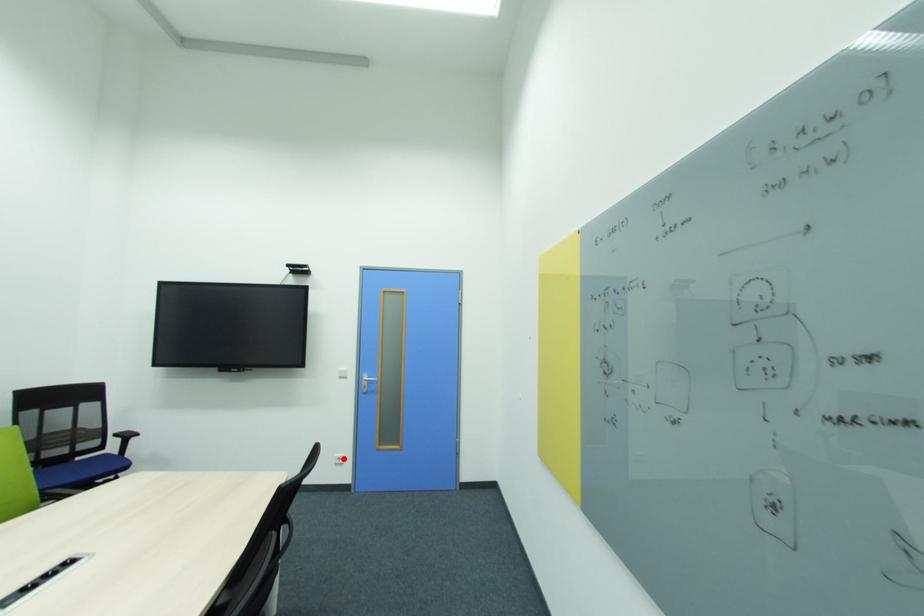
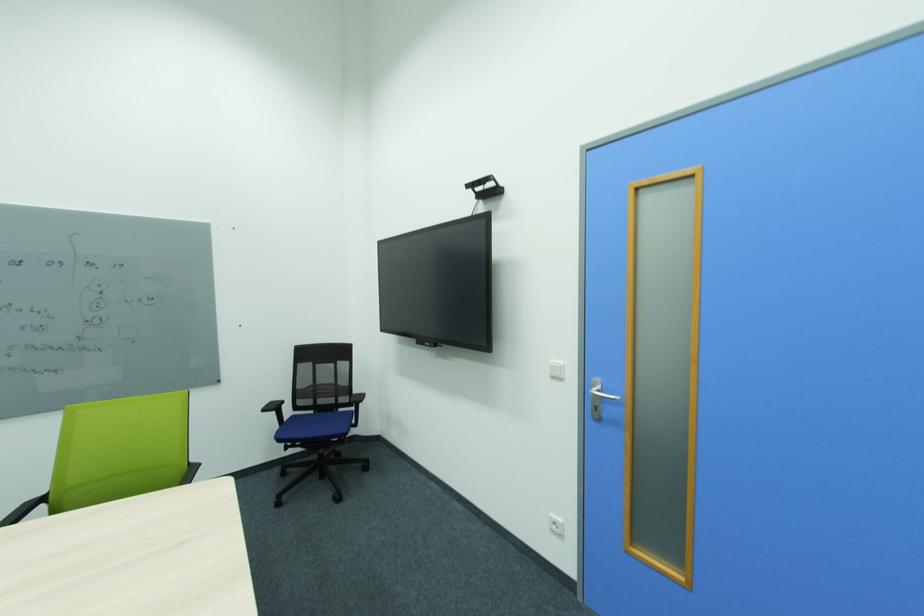
Find the pixel in the second image that matches the highlighted location in the first image.

(560, 525)